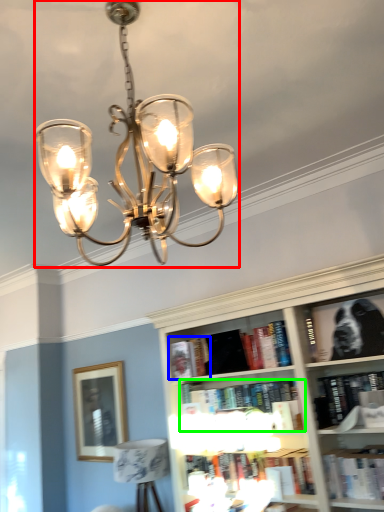
Question: Which object is the farthest from lamp (highlighted by a red box)? Choose among these: book (highlighted by a blue box) or book (highlighted by a green box).

Choices:
 (A) book
 (B) book

Answer: (A)